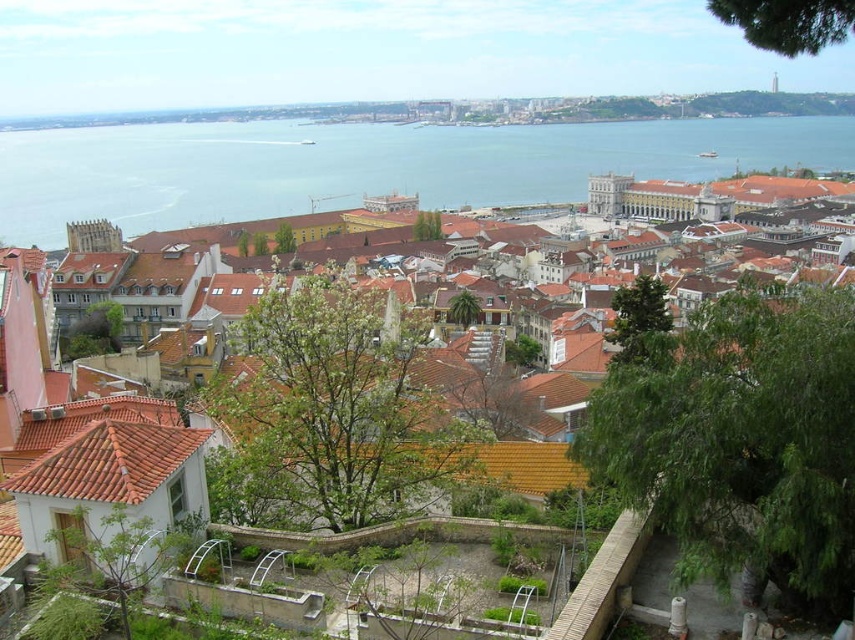
You are an architect analyzing the city layout. Based on the scene, which object is positioned to the left of the other between the brown tiled roofs at center and the blue water at center?

The brown tiled roofs at center are positioned to the left of the blue water at center according to the description.

You are a city planner analyzing this image. You need to determine which area is larger in the scene between the brown tiled roofs at center and the blue water at center. What is your conclusion?

→ The brown tiled roofs at center occupies less space than blue water at center, so the blue water at center is larger in the scene.